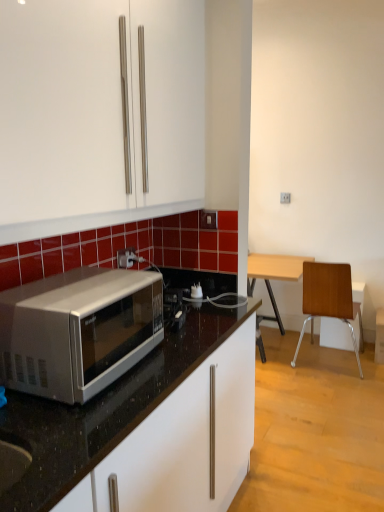
Question: Can you confirm if wooden/metallic chair at right is shorter than silver metallic microwave at left?

Choices:
 (A) no
 (B) yes

Answer: (A)

Question: Is there a large distance between wooden/metallic chair at right and silver metallic microwave at left?

Choices:
 (A) yes
 (B) no

Answer: (A)

Question: Is wooden/metallic chair at right to the right of silver metallic microwave at left from the viewer's perspective?

Choices:
 (A) yes
 (B) no

Answer: (A)

Question: Does wooden/metallic chair at right turn towards silver metallic microwave at left?

Choices:
 (A) yes
 (B) no

Answer: (B)

Question: Considering the relative sizes of wooden/metallic chair at right and silver metallic microwave at left in the image provided, is wooden/metallic chair at right taller than silver metallic microwave at left?

Choices:
 (A) no
 (B) yes

Answer: (B)

Question: From the image's perspective, does wooden/metallic chair at right appear higher than silver metallic microwave at left?

Choices:
 (A) no
 (B) yes

Answer: (A)

Question: Is white plastic power outlet at center smaller than silver metallic microwave at left?

Choices:
 (A) no
 (B) yes

Answer: (B)

Question: Considering the relative sizes of white plastic power outlet at center and silver metallic microwave at left in the image provided, is white plastic power outlet at center wider than silver metallic microwave at left?

Choices:
 (A) no
 (B) yes

Answer: (A)

Question: Could you tell me if white plastic power outlet at center is turned towards silver metallic microwave at left?

Choices:
 (A) no
 (B) yes

Answer: (A)

Question: Is white plastic power outlet at center not inside silver metallic microwave at left?

Choices:
 (A) no
 (B) yes

Answer: (B)

Question: Does white plastic power outlet at center have a greater height compared to silver metallic microwave at left?

Choices:
 (A) no
 (B) yes

Answer: (A)

Question: Is white plastic power outlet at center shorter than silver metallic microwave at left?

Choices:
 (A) yes
 (B) no

Answer: (A)

Question: Is the depth of silver metallic microwave at left greater than that of white plastic power outlet at center?

Choices:
 (A) no
 (B) yes

Answer: (A)